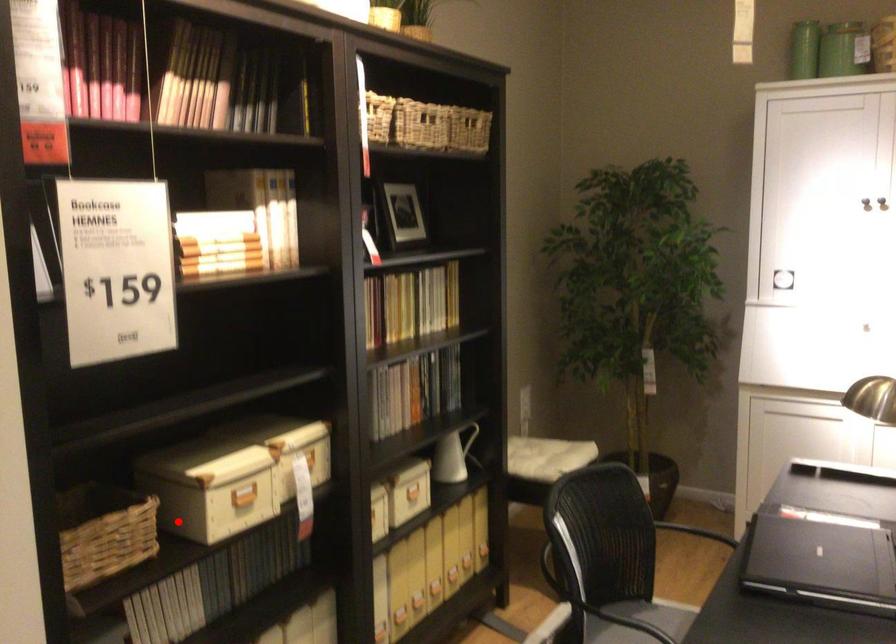
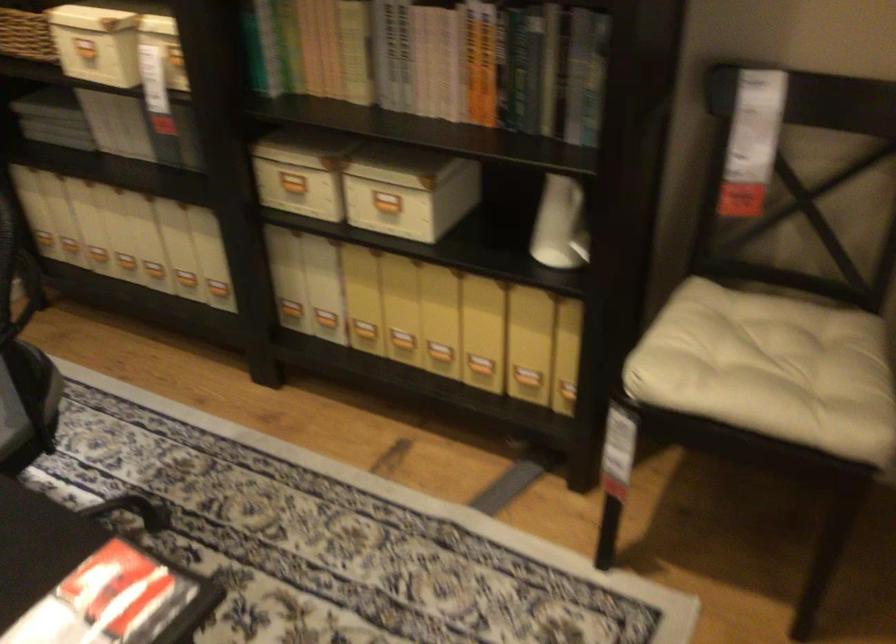
Find the pixel in the second image that matches the highlighted location in the first image.

(83, 49)